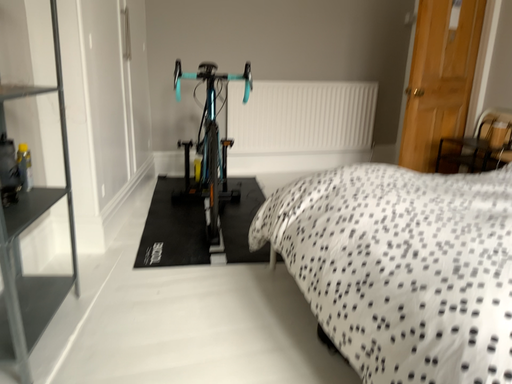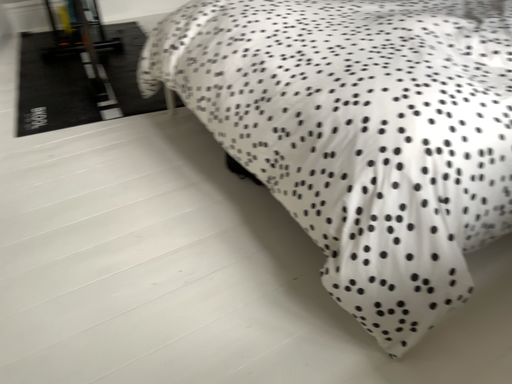
Question: How did the camera likely rotate when shooting the video?

Choices:
 (A) rotated left
 (B) rotated right

Answer: (B)